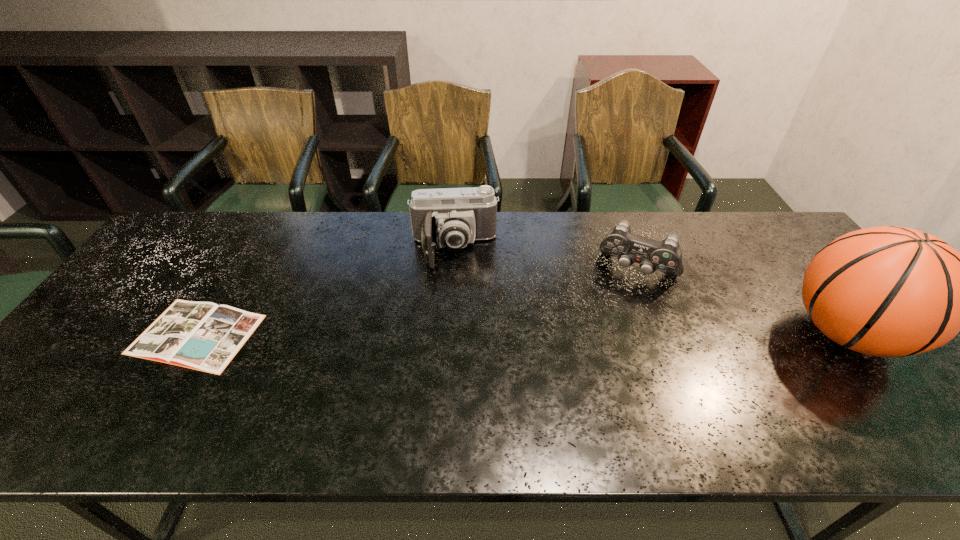
You are a GUI agent. You are given a task and a screenshot of the screen. Output one action in this format:
    pyautogui.click(x=<x>, y=<y>)
    Task: Click on the object that is at the right edge
    Image resolution: width=960 pixels, height=540 pixels.
    Given the screenshot: What is the action you would take?
    pyautogui.click(x=887, y=291)

The image size is (960, 540). Find the location of `object that is at the near left corner`. object that is at the near left corner is located at coordinates (204, 336).

At what (x,y) coordinates should I click in order to perform the action: click on object that is positioned at the near right corner. Please return your answer as a coordinate pair (x, y). The height and width of the screenshot is (540, 960). Looking at the image, I should click on (887, 291).

In the image, there is a desktop. Identify the location of vacant space at the far edge. Image resolution: width=960 pixels, height=540 pixels. (732, 238).

At what (x,y) coordinates should I click in order to perform the action: click on vacant area at the near edge of the desktop. Please return your answer as a coordinate pair (x, y). Looking at the image, I should click on (854, 401).

In the image, there is a desktop. Identify the location of vacant space at the left edge. (89, 355).

The width and height of the screenshot is (960, 540). In the image, there is a desktop. Identify the location of vacant space at the right edge. (801, 276).

Locate an element on the screen. The width and height of the screenshot is (960, 540). vacant space at the far left corner is located at coordinates (205, 233).

You are a GUI agent. You are given a task and a screenshot of the screen. Output one action in this format:
    pyautogui.click(x=<x>, y=<y>)
    Task: Click on the blank area at the far right corner
    The image size is (960, 540).
    Given the screenshot: What is the action you would take?
    pyautogui.click(x=796, y=251)

Image resolution: width=960 pixels, height=540 pixels. Identify the location of free area in between the basketball and the second object from left to right. (650, 292).